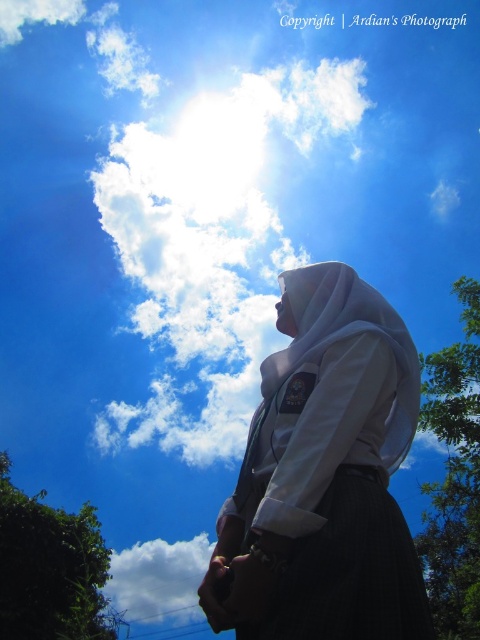
Question: Is white matte uniform at center bigger than white fluffy cloud at lower left?

Choices:
 (A) yes
 (B) no

Answer: (B)

Question: Is white matte uniform at center bigger than white fluffy cloud at lower left?

Choices:
 (A) yes
 (B) no

Answer: (B)

Question: Which of the following is the closest to the observer?

Choices:
 (A) white matte uniform at center
 (B) white fluffy cloud at lower left

Answer: (A)

Question: Does white matte uniform at center appear over white fluffy cloud at lower left?

Choices:
 (A) no
 (B) yes

Answer: (B)